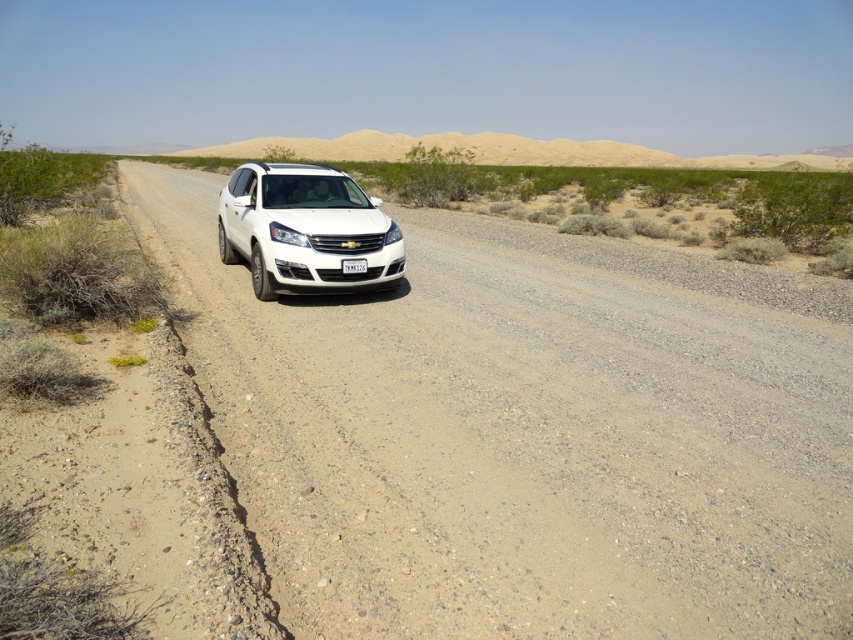
You are a driver planning to take a photo of the white glossy suv at center from a distance of 10 meters. Given that the suv is at point 0.361, 0.359, can you estimate how far to the left or right you should position yourself to capture the entire vehicle in the frame?

The white glossy suv at center is positioned at coordinates [305,230]. To capture the entire vehicle in the frame from 10 meters away, you should position yourself directly in front of the suv at the center point to ensure the entire vehicle fits within the camera frame.